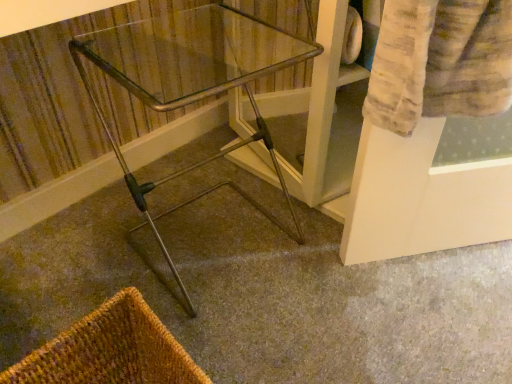
Measure the distance between clear glass table at center and camera.

25.38 inches.

Find the location of `clear glass table at center`. clear glass table at center is located at coordinates (186, 105).

Image resolution: width=512 pixels, height=384 pixels. What do you see at coordinates (110, 350) in the screenshot?
I see `brown woven basket at lower left` at bounding box center [110, 350].

I want to click on clear glass table at center, so click(x=186, y=105).

Is point (81, 46) in front of point (130, 344)?

No, it is behind (130, 344).

Is brown woven basket at lower left inside clear glass table at center?

No, brown woven basket at lower left is located outside of clear glass table at center.

Is brown woven basket at lower left at the back of clear glass table at center?

clear glass table at center is not turned away from brown woven basket at lower left.

Identify the location of basket below the clear glass table at center (from the image's perspective). (110, 350).

From a real-world perspective, relative to brown woven basket at lower left, is metallic silver walker at center vertically above or below?

Clearly, from a real-world perspective, metallic silver walker at center is below brown woven basket at lower left.

Does metallic silver walker at center have a greater width compared to brown woven basket at lower left?

Correct, the width of metallic silver walker at center exceeds that of brown woven basket at lower left.

Is point (270, 300) positioned after point (104, 358)?

Yes, it is behind point (104, 358).

Considering the positions of objects metallic silver walker at center and brown woven basket at lower left in the image provided, who is more to the right, metallic silver walker at center or brown woven basket at lower left?

metallic silver walker at center.

Is metallic silver walker at center at the back of brown woven basket at lower left?

No, brown woven basket at lower left is not facing the opposite direction of metallic silver walker at center.

Is the surface of brown woven basket at lower left in direct contact with metallic silver walker at center?

There is a gap between brown woven basket at lower left and metallic silver walker at center.

Can you tell me how much brown woven basket at lower left and metallic silver walker at center differ in facing direction?

4.08 degrees separate the facing orientations of brown woven basket at lower left and metallic silver walker at center.

Is metallic silver walker at center far away from clear glass table at center?

No, there isn't a large distance between metallic silver walker at center and clear glass table at center.

In the image, is metallic silver walker at center on the left side or the right side of clear glass table at center?

metallic silver walker at center is positioned on clear glass table at center's right side.

What's the angular difference between metallic silver walker at center and clear glass table at center's facing directions?

There is a 8.92-degree angle between the facing directions of metallic silver walker at center and clear glass table at center.

Locate an element on the screen. Image resolution: width=512 pixels, height=384 pixels. concrete located in front of the clear glass table at center is located at coordinates (265, 295).

Is clear glass table at center facing towards metallic silver walker at center?

No, clear glass table at center is not oriented towards metallic silver walker at center.

Considering the sizes of objects clear glass table at center and metallic silver walker at center in the image provided, who is wider, clear glass table at center or metallic silver walker at center?

With larger width is metallic silver walker at center.

Would you say clear glass table at center is outside metallic silver walker at center?

Yes, clear glass table at center is located beyond the bounds of metallic silver walker at center.

From a real-world perspective, which is physically below, brown woven basket at lower left or clear glass table at center?

In real-world perspective, brown woven basket at lower left is lower.

Is brown woven basket at lower left bigger or smaller than clear glass table at center?

brown woven basket at lower left is smaller than clear glass table at center.

From the image's perspective, between brown woven basket at lower left and clear glass table at center, which one is located above?

clear glass table at center.

Is brown woven basket at lower left far away from clear glass table at center?

brown woven basket at lower left is near clear glass table at center, not far away.

Locate an element on the screen. Image resolution: width=512 pixels, height=384 pixels. furniture behind the brown woven basket at lower left is located at coordinates (186, 105).

Find the location of a particular element. The width and height of the screenshot is (512, 384). concrete below the brown woven basket at lower left (from a real-world perspective) is located at coordinates (265, 295).

Which object lies further to the anchor point clear glass table at center, brown woven basket at lower left or metallic silver walker at center?

brown woven basket at lower left is further to clear glass table at center.

When comparing their distances from clear glass table at center, does metallic silver walker at center or brown woven basket at lower left seem closer?

metallic silver walker at center is positioned closer to the anchor clear glass table at center.

Based on their spatial positions, is metallic silver walker at center or clear glass table at center closer to brown woven basket at lower left?

Based on the image, metallic silver walker at center appears to be nearer to brown woven basket at lower left.

When comparing their distances from metallic silver walker at center, does clear glass table at center or brown woven basket at lower left seem further?

brown woven basket at lower left.

Estimate the real-world distances between objects in this image. Which object is further from metallic silver walker at center, brown woven basket at lower left or clear glass table at center?

brown woven basket at lower left is further to metallic silver walker at center.

Consider the image. Based on their spatial positions, is clear glass table at center or metallic silver walker at center closer to brown woven basket at lower left?

Based on the image, metallic silver walker at center appears to be nearer to brown woven basket at lower left.

Image resolution: width=512 pixels, height=384 pixels. What are the coordinates of `concrete between clear glass table at center and brown woven basket at lower left in the up-down direction` in the screenshot? It's located at (265, 295).